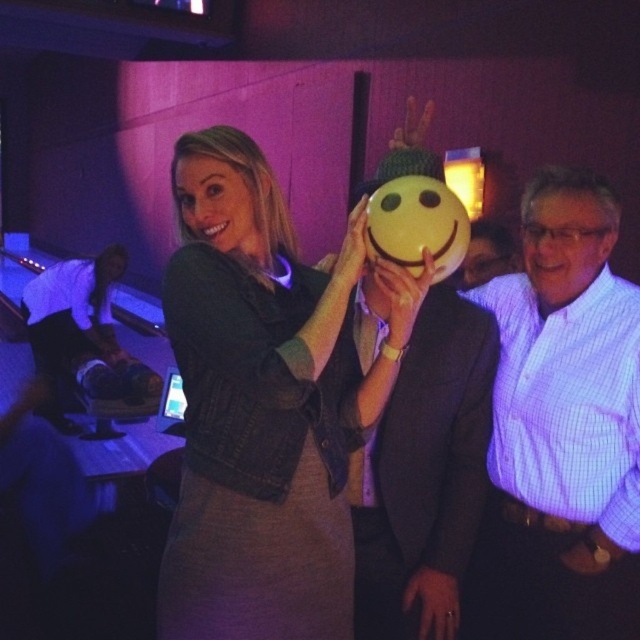
Question: Which point is closer to the camera?

Choices:
 (A) (564, 298)
 (B) (196, 202)

Answer: (B)

Question: Is smooth skin face at center above matte plastic face at center?

Choices:
 (A) no
 (B) yes

Answer: (A)

Question: Does matte purple shirt at right have a greater width compared to smooth skin face at upper center?

Choices:
 (A) no
 (B) yes

Answer: (B)

Question: Is matte black dress at center smaller than smooth skin face at upper center?

Choices:
 (A) yes
 (B) no

Answer: (B)

Question: Which is farther from the matte plastic face at center?

Choices:
 (A) smooth skin face at center
 (B) white checkered shirt at center
 (C) matte purple shirt at right
 (D) smooth skin face at upper center

Answer: (D)

Question: Which of the following is the closest to the observer?

Choices:
 (A) matte purple shirt at right
 (B) matte plastic face at center
 (C) smooth skin face at upper center

Answer: (A)